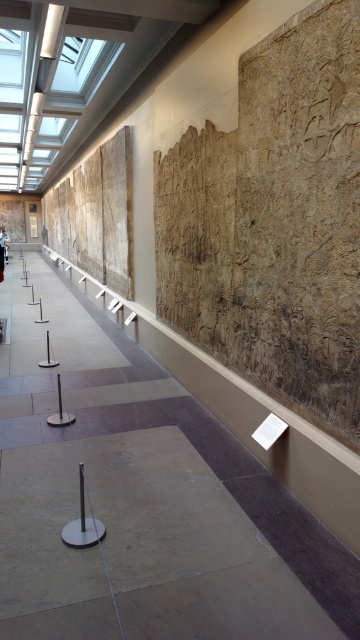
Does silver/metallic pole at center appear under white cotton shirt at center?

Indeed, silver/metallic pole at center is positioned under white cotton shirt at center.

What do you see at coordinates (82, 497) in the screenshot? I see `silver/metallic pole at center` at bounding box center [82, 497].

Describe the element at coordinates (82, 497) in the screenshot. The image size is (360, 640). I see `silver/metallic pole at center` at that location.

The image size is (360, 640). Find the location of `silver/metallic pole at center`. silver/metallic pole at center is located at coordinates (82, 497).